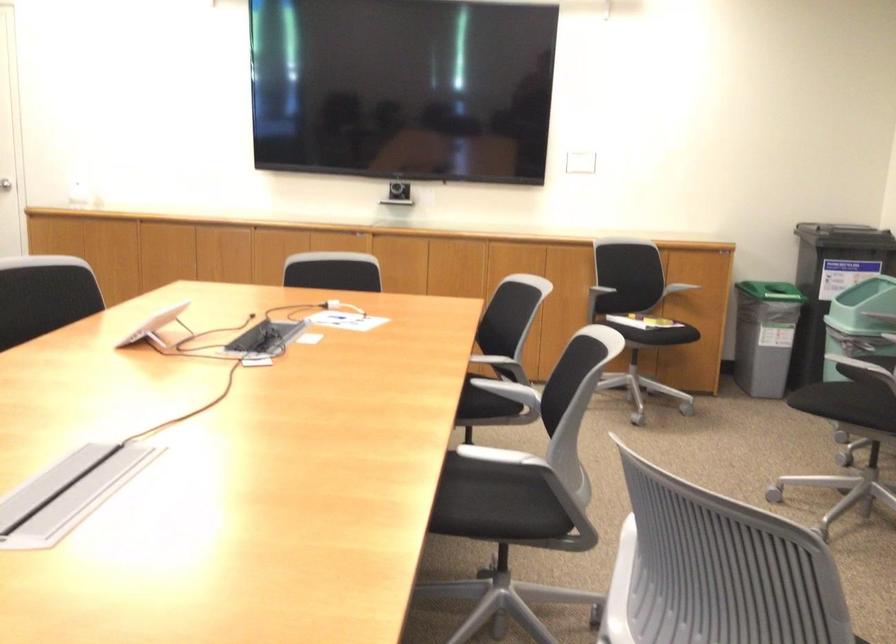
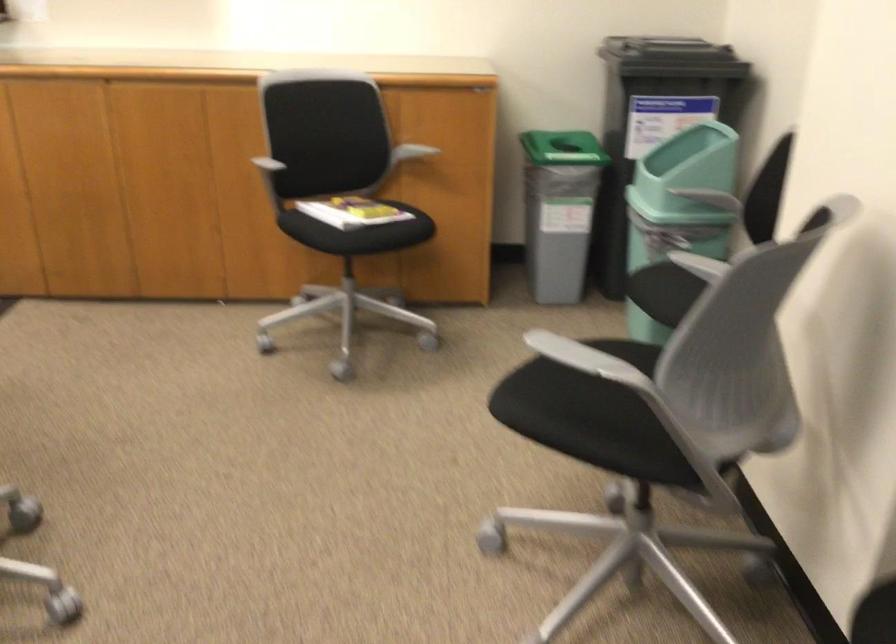
Locate, in the second image, the point that corresponds to (643,303) in the first image.

(351, 211)